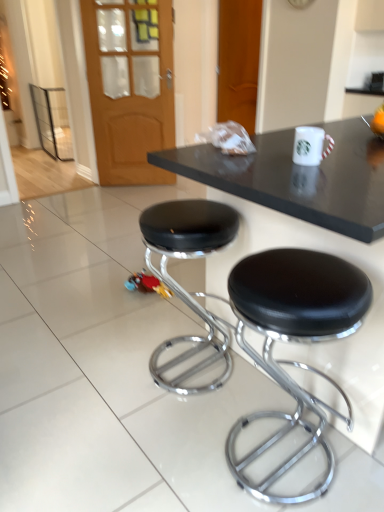
The image size is (384, 512). I want to click on vacant region above black leather stool at lower right, positioned as the second stool in left-to-right order (from a real-world perspective), so click(x=301, y=276).